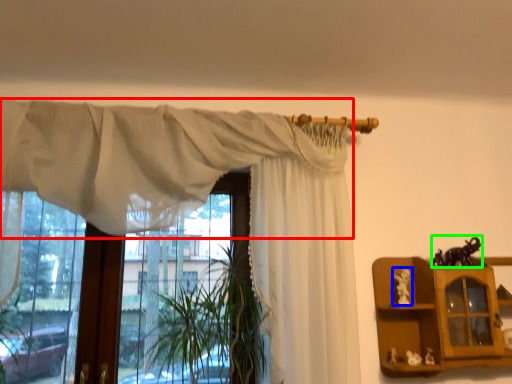
Question: Estimate the real-world distances between objects in this image. Which object is farther from curtain (highlighted by a red box), toy (highlighted by a blue box) or toy (highlighted by a green box)?

Choices:
 (A) toy
 (B) toy

Answer: (B)